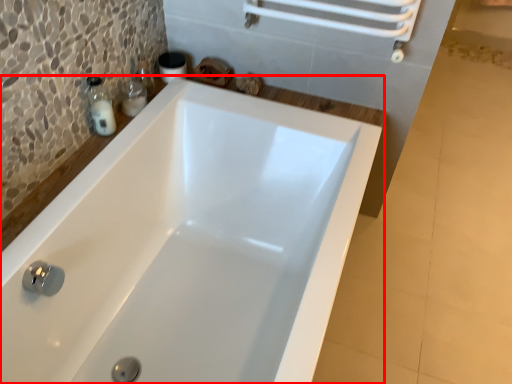
Question: Observing the image, what is the correct spatial positioning of bathtub (annotated by the red box) in reference to soap dispenser?

Choices:
 (A) right
 (B) left

Answer: (A)